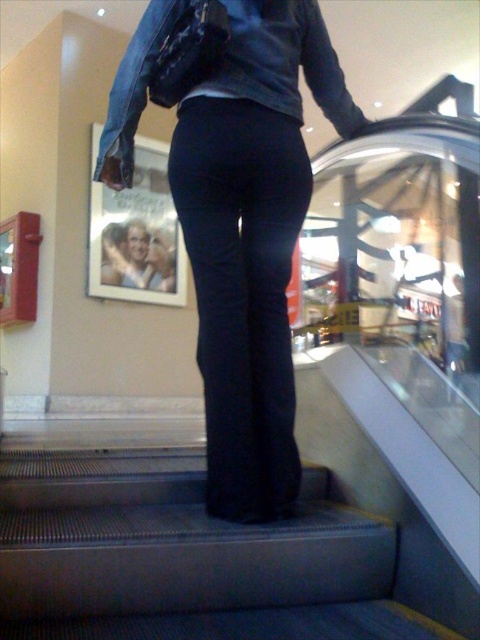
Question: Is black fabric stairs at center positioned before denim jacket at upper center?

Choices:
 (A) no
 (B) yes

Answer: (B)

Question: Which object appears closest to the camera in this image?

Choices:
 (A) dark blue jeans at center
 (B) denim jacket at upper center

Answer: (A)

Question: Estimate the real-world distances between objects in this image. Which object is farther from the denim jacket at upper center?

Choices:
 (A) dark blue jeans at center
 (B) black fabric stairs at center

Answer: (B)

Question: Is black fabric stairs at center thinner than denim jacket at upper center?

Choices:
 (A) yes
 (B) no

Answer: (B)

Question: Is dark blue jeans at center closer to the viewer compared to denim jacket at upper center?

Choices:
 (A) no
 (B) yes

Answer: (B)

Question: Which object appears farthest from the camera in this image?

Choices:
 (A) black fabric stairs at center
 (B) dark blue jeans at center
 (C) denim jacket at upper center

Answer: (C)